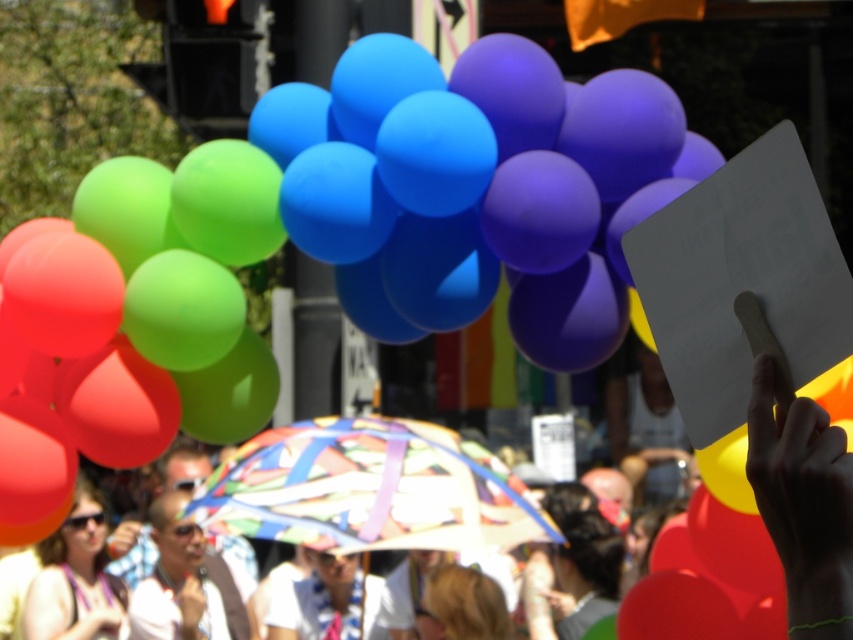
You are at a parade and see the rubber balloons at upper center and the matte plastic umbrella at center. Which object is positioned higher in the sky?

The rubber balloons at upper center are positioned higher in the sky than the matte plastic umbrella at center.